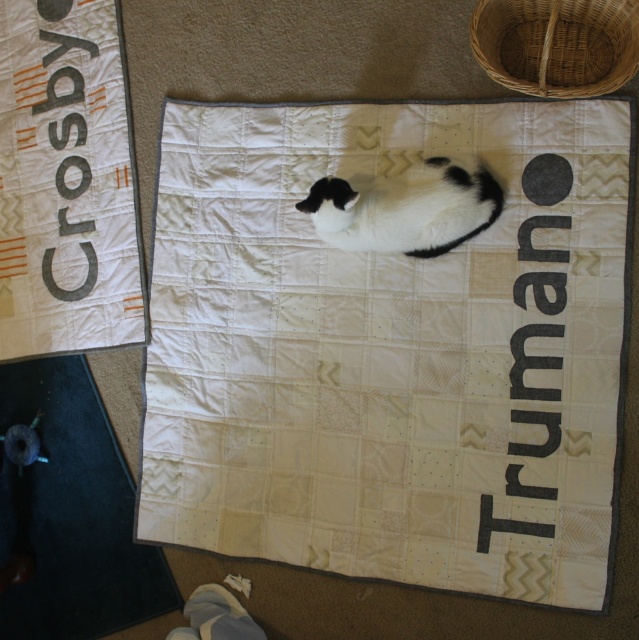
From the picture: Can you confirm if white quilt at upper left is bigger than dark gray rubber mat at lower left?

Indeed, white quilt at upper left has a larger size compared to dark gray rubber mat at lower left.

Between point (68, 339) and point (33, 632), which one is positioned in front?

Point (68, 339)

The height and width of the screenshot is (640, 639). In order to click on white quilt at upper left in this screenshot , I will do `click(66, 182)`.

This screenshot has height=640, width=639. Find the location of `white quilt at upper left`. white quilt at upper left is located at coordinates (66, 182).

Is the position of white quilt at center more distant than that of dark gray rubber mat at lower left?

No, white quilt at center is closer to the viewer.

Which is above, white quilt at center or dark gray rubber mat at lower left?

white quilt at center is above.

Describe the element at coordinates (390, 349) in the screenshot. This screenshot has width=639, height=640. I see `white quilt at center` at that location.

Where is `white quilt at center`? This screenshot has height=640, width=639. white quilt at center is located at coordinates (390, 349).

Can you confirm if white quilt at center is shorter than black and white fur cat at center?

Incorrect, white quilt at center's height does not fall short of black and white fur cat at center's.

Which of these two, white quilt at center or black and white fur cat at center, stands shorter?

Standing shorter between the two is black and white fur cat at center.

Is point (387, 337) farther from camera compared to point (456, 243)?

Yes, it is behind point (456, 243).

This screenshot has width=639, height=640. What are the coordinates of `white quilt at center` in the screenshot? It's located at (390, 349).